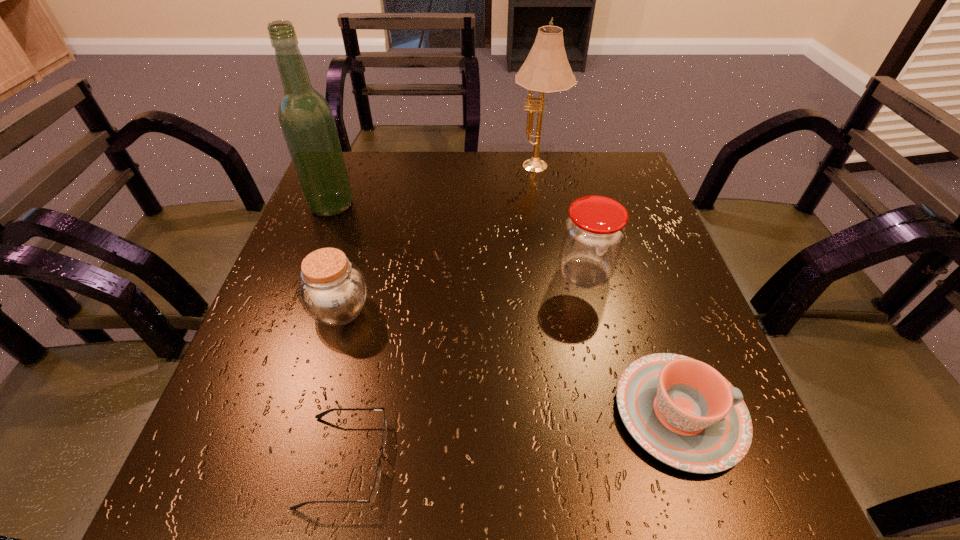
Image resolution: width=960 pixels, height=540 pixels. Identify the location of free space between the fifth tallest object and the right jar. (632, 344).

Identify which object is the nearest to the right jar. Please provide its 2D coordinates. Your answer should be formatted as a tuple, i.e. [(x, y)], where the tuple contains the x and y coordinates of a point satisfying the conditions above.

[(683, 412)]

Point out which object is positioned as the second nearest to the right jar. Please provide its 2D coordinates. Your answer should be formatted as a tuple, i.e. [(x, y)], where the tuple contains the x and y coordinates of a point satisfying the conditions above.

[(546, 70)]

Find the location of `free point that satisfies the following two spatial constraints: 1. on the front side of the farthest object; 2. on the left side of the fourth shortest object`. free point that satisfies the following two spatial constraints: 1. on the front side of the farthest object; 2. on the left side of the fourth shortest object is located at coordinates (554, 275).

I want to click on vacant space that satisfies the following two spatial constraints: 1. on the back side of the left jar; 2. on the left side of the fourth shortest object, so click(350, 275).

This screenshot has height=540, width=960. I want to click on blank area in the image that satisfies the following two spatial constraints: 1. on the front side of the lampshade; 2. on the right side of the third tallest object, so click(x=554, y=275).